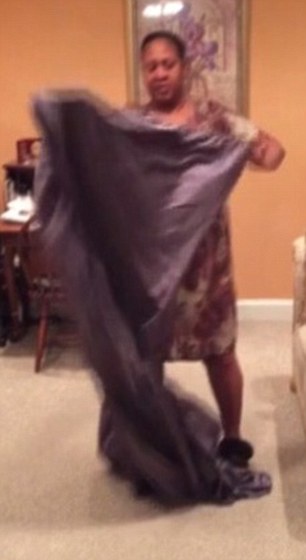
Find the location of a particular element. painting is located at coordinates (204, 42).